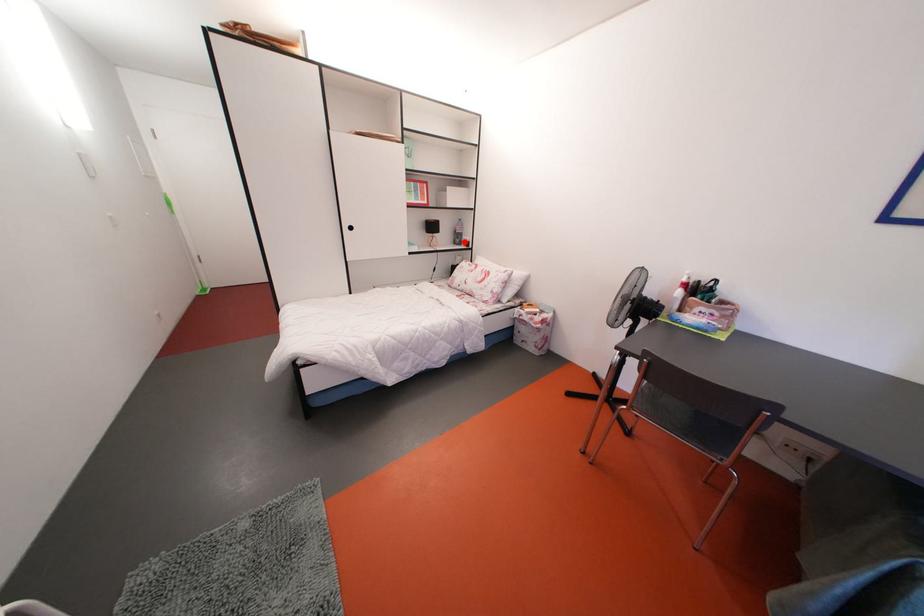
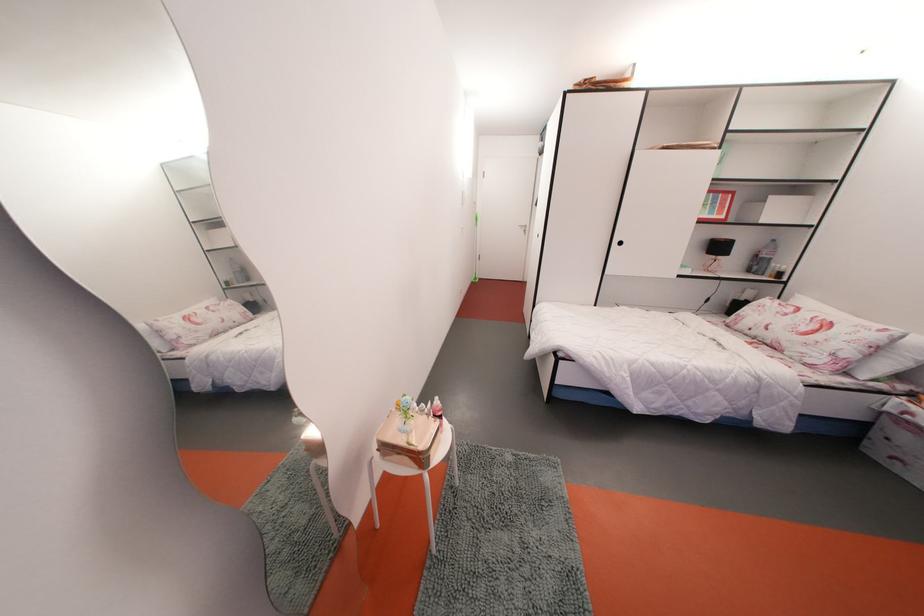
Question: I am providing you with two images of the same scene from different viewpoints. A red point is shown in image1. For the corresponding object point in image2, is it positioned nearer or farther from the camera?

Choices:
 (A) Nearer
 (B) Farther

Answer: (B)